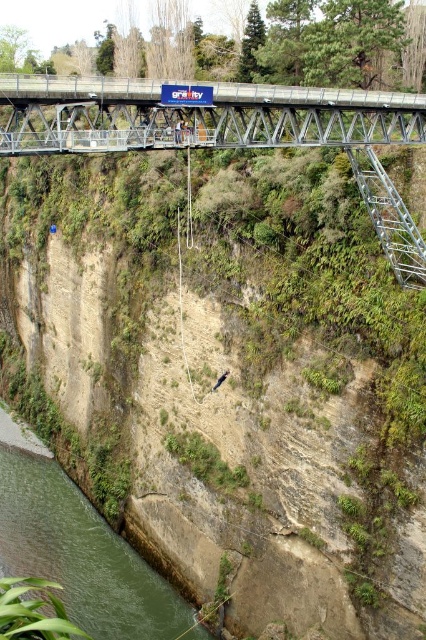
Question: Considering the real-world distances, which object is closest to the metallic gray bridge at upper center?

Choices:
 (A) green concrete river at lower left
 (B) metallic silver ladder at right

Answer: (B)

Question: Where is metallic gray bridge at upper center located in relation to green concrete river at lower left in the image?

Choices:
 (A) below
 (B) above

Answer: (B)

Question: Is metallic gray bridge at upper center to the left of green concrete river at lower left from the viewer's perspective?

Choices:
 (A) yes
 (B) no

Answer: (B)

Question: Which point appears farthest from the camera in this image?

Choices:
 (A) (362, 180)
 (B) (66, 540)

Answer: (B)

Question: Observing the image, what is the correct spatial positioning of metallic gray bridge at upper center in reference to metallic silver ladder at right?

Choices:
 (A) below
 (B) above

Answer: (B)

Question: Which object appears farthest from the camera in this image?

Choices:
 (A) green concrete river at lower left
 (B) metallic silver ladder at right

Answer: (A)